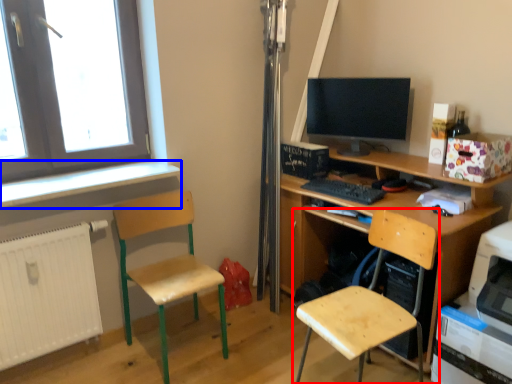
Question: Which point is closer to the camera, chair (highlighted by a red box) or window sill (highlighted by a blue box)?

Choices:
 (A) chair
 (B) window sill

Answer: (A)